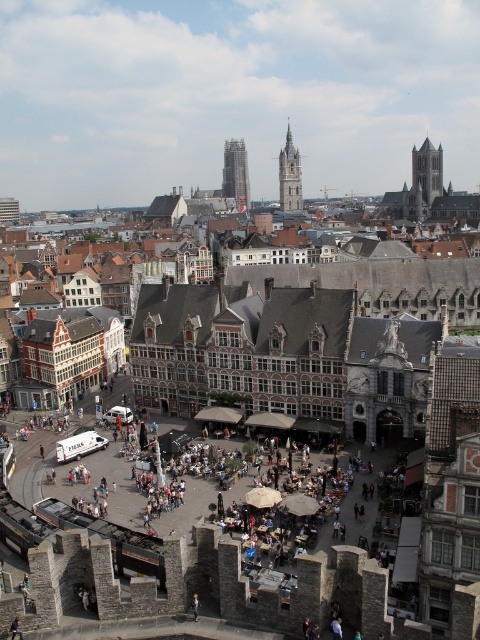
You are an architect analyzing the urban layout. Given the image, which structure is positioned higher in the scene between the glassy steel skyscraper at center and the gray stone clock tower at center?

The glassy steel skyscraper at center is positioned higher in the scene than the gray stone clock tower at center according to the description.

You are an urban planner assessing the city layout. You need to determine which structure occupies more horizontal space in the image. Which one is wider between the glassy steel skyscraper at center and the gray stone tower at upper right?

The glassy steel skyscraper at center is wider than the gray stone tower at upper right according to the description.